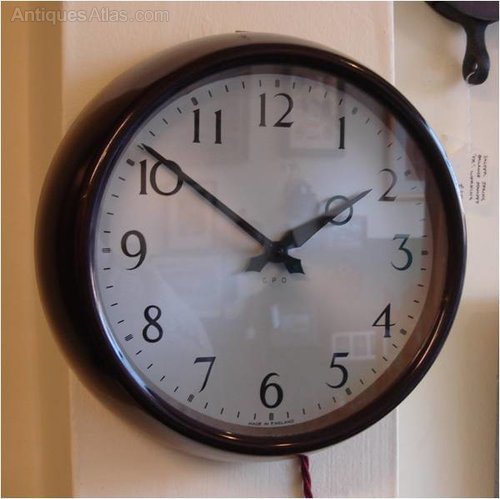
Where is `circular white clock face`? This screenshot has height=499, width=500. circular white clock face is located at coordinates (275, 358).